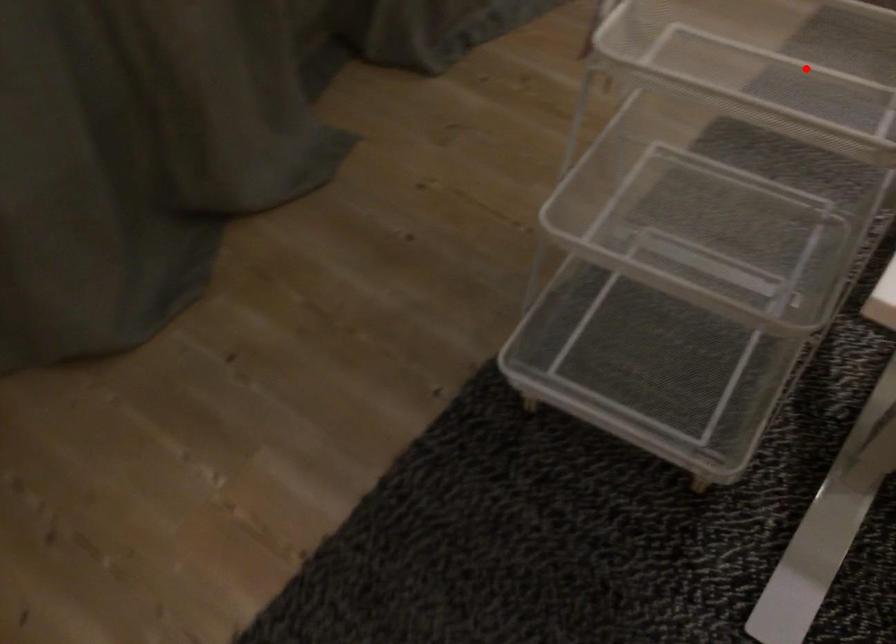
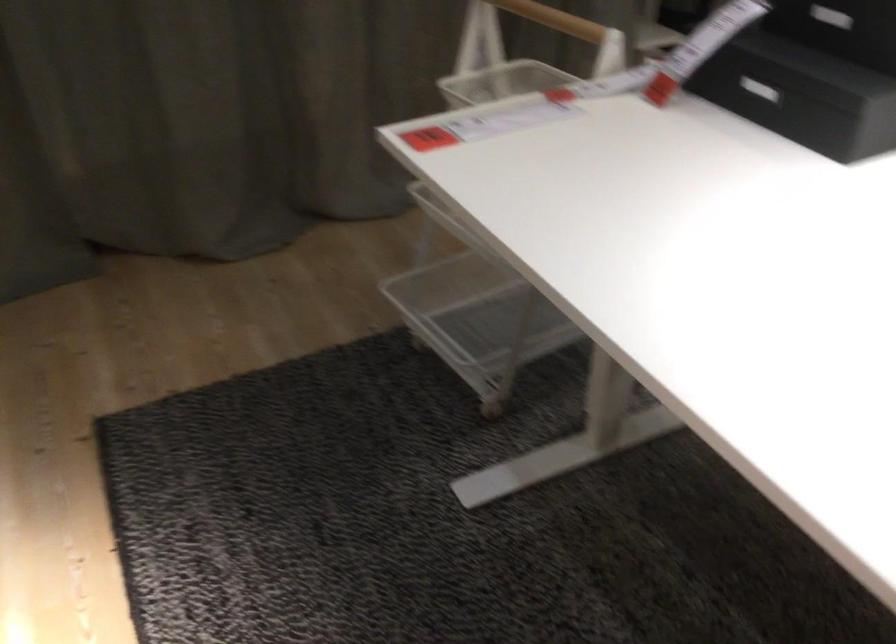
Question: I am providing you with two images of the same scene from different viewpoints. A red point is marked on the first image. Can you still see the location of the red point in image 2?

Choices:
 (A) Yes
 (B) No

Answer: (B)